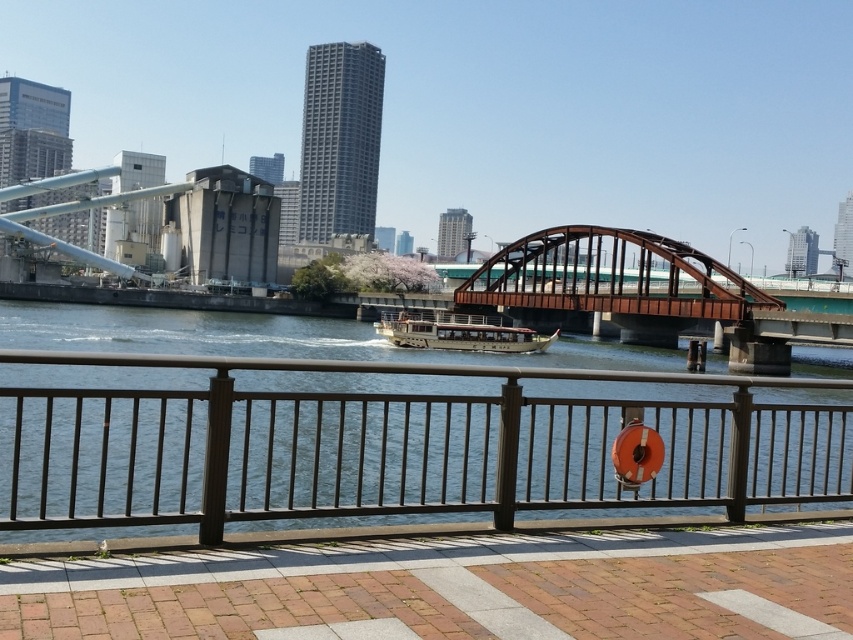
Image resolution: width=853 pixels, height=640 pixels. I want to click on metal/rustic fence at center, so click(x=390, y=442).

Can you confirm if metal/rustic fence at center is thinner than brown metallic bridge at center?

Yes, metal/rustic fence at center is thinner than brown metallic bridge at center.

Who is more forward, (x=218, y=394) or (x=550, y=259)?

Point (x=218, y=394)

Where is `metal/rustic fence at center`? The width and height of the screenshot is (853, 640). metal/rustic fence at center is located at coordinates (390, 442).

The width and height of the screenshot is (853, 640). Describe the element at coordinates (390, 442) in the screenshot. I see `metal/rustic fence at center` at that location.

Is metal/rustic fence at center closer to camera compared to wooden polished boat at center?

That is True.

The image size is (853, 640). I want to click on metal/rustic fence at center, so click(x=390, y=442).

Where is `metal/rustic fence at center`? metal/rustic fence at center is located at coordinates (390, 442).

Does brown metallic bridge at center have a larger size compared to wooden polished boat at center?

Correct, brown metallic bridge at center is larger in size than wooden polished boat at center.

Between brown metallic bridge at center and wooden polished boat at center, which one has less height?

wooden polished boat at center

Does point (595, 234) come closer to viewer compared to point (447, 332)?

No.

At what (x,y) coordinates should I click in order to perform the action: click on brown metallic bridge at center. Please return your answer as a coordinate pair (x, y). This screenshot has width=853, height=640. Looking at the image, I should click on (611, 282).